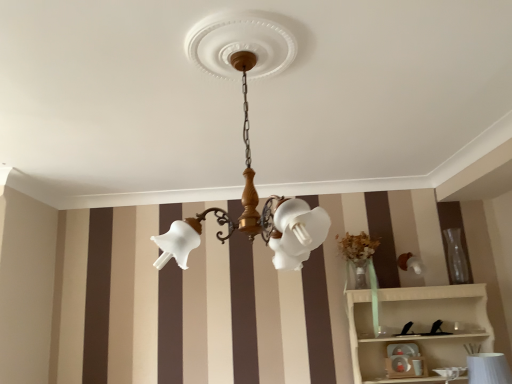
Question: Does matte white toy at lower center have a lesser height compared to white wood shelf at lower right?

Choices:
 (A) no
 (B) yes

Answer: (B)

Question: Is matte white toy at lower center looking in the opposite direction of white wood shelf at lower right?

Choices:
 (A) no
 (B) yes

Answer: (B)

Question: Considering the relative positions of matte white toy at lower center and white wood shelf at lower right in the image provided, is matte white toy at lower center to the left of white wood shelf at lower right from the viewer's perspective?

Choices:
 (A) yes
 (B) no

Answer: (A)

Question: Is white wood shelf at lower right surrounded by matte white toy at lower center?

Choices:
 (A) no
 (B) yes

Answer: (A)

Question: Is matte white toy at lower center behind white wood shelf at lower right?

Choices:
 (A) yes
 (B) no

Answer: (A)

Question: Considering the positions of transparent glass vase at right and white wood shelf at lower right in the image, is transparent glass vase at right wider or thinner than white wood shelf at lower right?

Choices:
 (A) wide
 (B) thin

Answer: (B)

Question: From a real-world perspective, is transparent glass vase at right positioned above or below white wood shelf at lower right?

Choices:
 (A) above
 (B) below

Answer: (A)

Question: In terms of size, does transparent glass vase at right appear bigger or smaller than white wood shelf at lower right?

Choices:
 (A) small
 (B) big

Answer: (A)

Question: Considering the positions of transparent glass vase at right and white wood shelf at lower right in the image, is transparent glass vase at right taller or shorter than white wood shelf at lower right?

Choices:
 (A) tall
 (B) short

Answer: (B)

Question: Is matte white toy at lower center spatially inside transparent glass vase at right, or outside of it?

Choices:
 (A) outside
 (B) inside

Answer: (A)

Question: In terms of width, does matte white toy at lower center look wider or thinner when compared to transparent glass vase at right?

Choices:
 (A) wide
 (B) thin

Answer: (A)

Question: Based on their sizes in the image, would you say matte white toy at lower center is bigger or smaller than transparent glass vase at right?

Choices:
 (A) small
 (B) big

Answer: (B)

Question: Is matte white toy at lower center to the left or to the right of transparent glass vase at right in the image?

Choices:
 (A) right
 (B) left

Answer: (B)

Question: Considering the positions of white wood shelf at lower right and matte white toy at lower center in the image, is white wood shelf at lower right bigger or smaller than matte white toy at lower center?

Choices:
 (A) small
 (B) big

Answer: (B)

Question: In terms of height, does white wood shelf at lower right look taller or shorter compared to matte white toy at lower center?

Choices:
 (A) short
 (B) tall

Answer: (B)